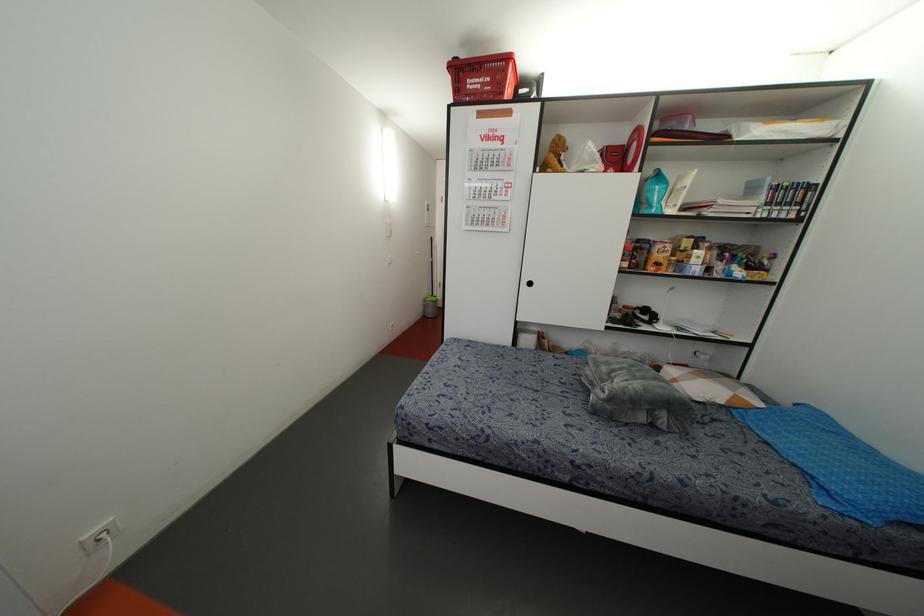
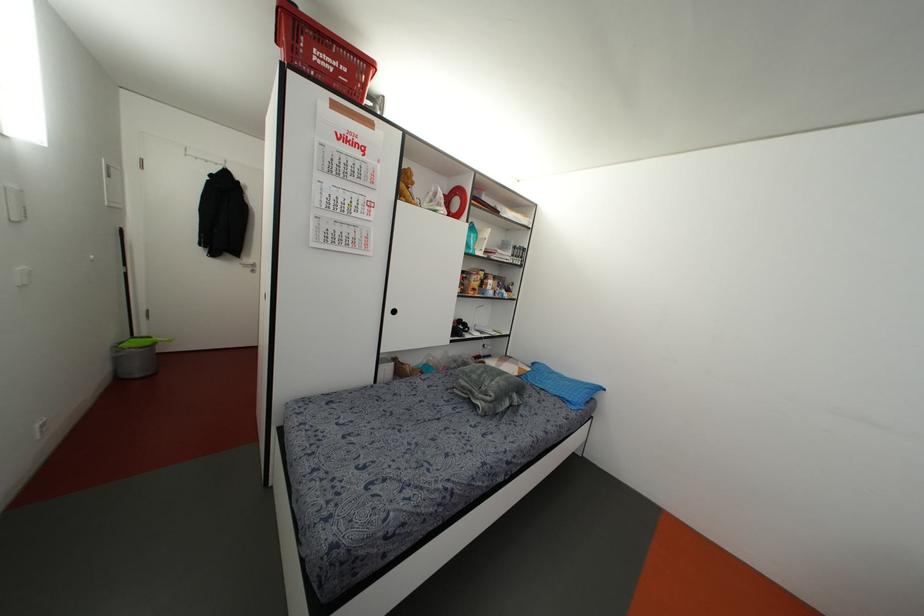
The point at (831, 487) is marked in the first image. Where is the corresponding point in the second image?

(569, 399)